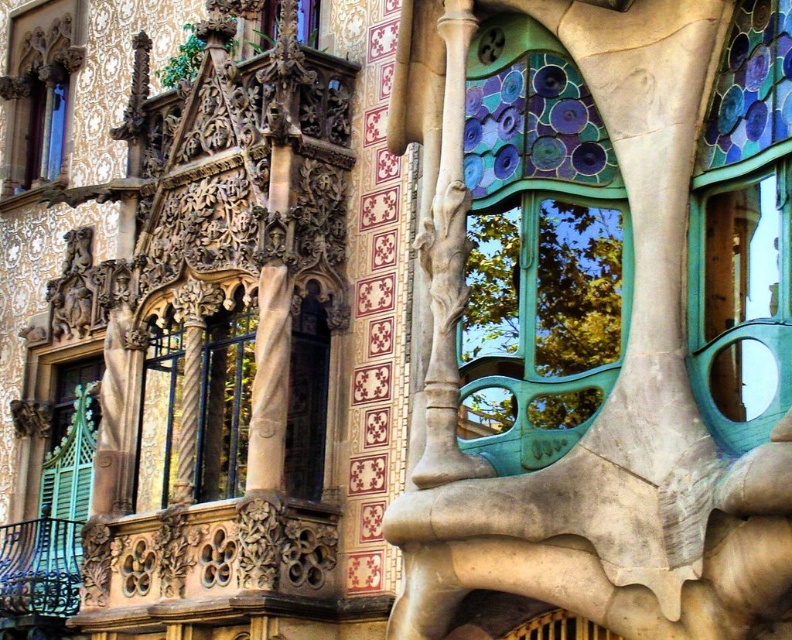
Which is above, matte glass window at upper left or matte glass window at upper center?

matte glass window at upper left

Which is more to the left, matte glass window at upper left or matte glass window at upper center?

From the viewer's perspective, matte glass window at upper left appears more on the left side.

Does point (48, 24) come farther from viewer compared to point (269, 26)?

Yes, point (48, 24) is behind point (269, 26).

Identify the location of matte glass window at upper left. Image resolution: width=792 pixels, height=640 pixels. (40, 90).

Can you confirm if matte stone sculpture at center is positioned to the right of green patina glass at center right?

Correct, you'll find matte stone sculpture at center to the right of green patina glass at center right.

Is matte stone sculpture at center taller than green patina glass at center right?

Yes, matte stone sculpture at center is taller than green patina glass at center right.

The height and width of the screenshot is (640, 792). Find the location of `matte stone sculpture at center`. matte stone sculpture at center is located at coordinates (623, 404).

The width and height of the screenshot is (792, 640). What are the coordinates of `matte stone sculpture at center` in the screenshot? It's located at (623, 404).

Which is more to the left, matte stone sculpture at center or matte glass window at upper left?

matte glass window at upper left is more to the left.

Between point (636, 444) and point (48, 97), which one is positioned behind?

Point (48, 97)

I want to click on matte stone sculpture at center, so click(x=623, y=404).